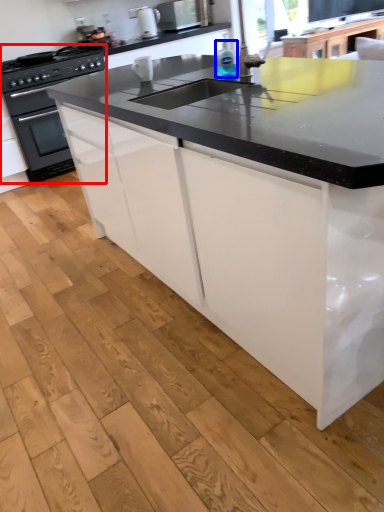
Question: Which point is further to the camera, home appliance (highlighted by a red box) or bottle (highlighted by a blue box)?

Choices:
 (A) home appliance
 (B) bottle

Answer: (A)